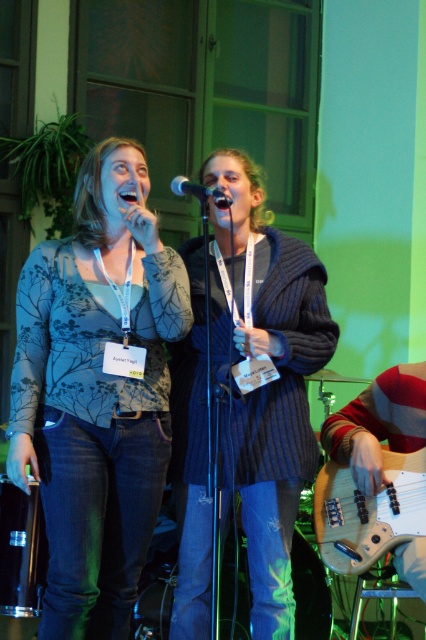
Question: Which object is closer to the camera taking this photo?

Choices:
 (A) light brown wood guitar at lower right
 (B) metallic silver microphone at center
 (C) matte floral top at center
 (D) knitted dark blue sweater at center

Answer: (B)

Question: Is matte floral top at center bigger than light brown wood guitar at lower right?

Choices:
 (A) yes
 (B) no

Answer: (A)

Question: From the image, what is the correct spatial relationship of matte floral top at center in relation to light brown wood guitar at lower right?

Choices:
 (A) left
 (B) right

Answer: (A)

Question: Among these objects, which one is nearest to the camera?

Choices:
 (A) light brown wood guitar at lower right
 (B) matte floral top at center

Answer: (B)

Question: Among these objects, which one is nearest to the camera?

Choices:
 (A) matte floral top at center
 (B) light brown wood guitar at lower right
 (C) knitted dark blue sweater at center
 (D) metallic silver microphone at center

Answer: (D)

Question: Is knitted dark blue sweater at center bigger than metallic silver microphone at center?

Choices:
 (A) no
 (B) yes

Answer: (B)